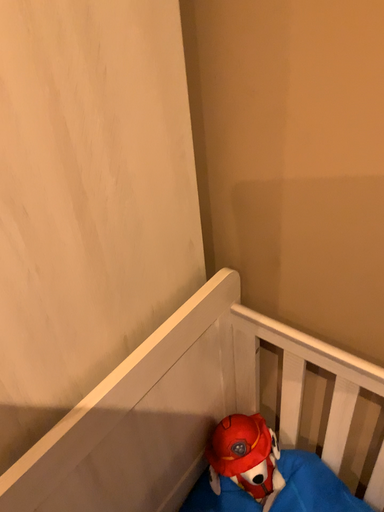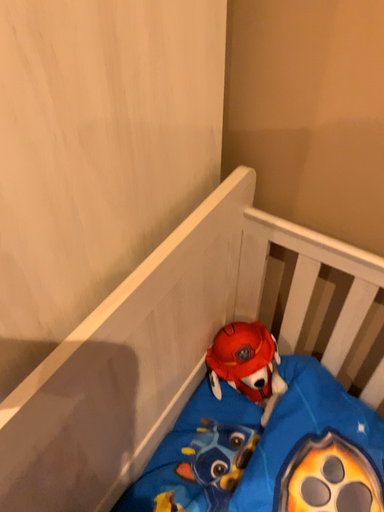
Question: How did the camera likely rotate when shooting the video?

Choices:
 (A) rotated downward
 (B) rotated upward

Answer: (A)